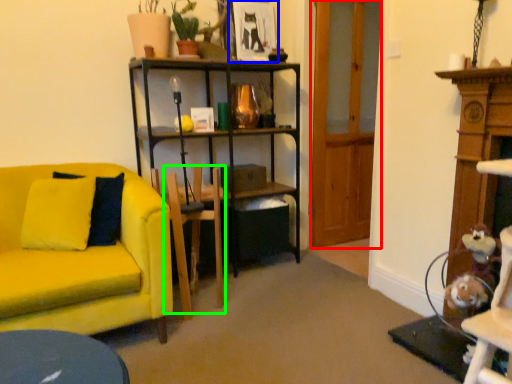
Question: Considering the real-world distances, which object is closest to glass door (highlighted by a red box)? picture frame (highlighted by a blue box) or swivel chair (highlighted by a green box).

Choices:
 (A) picture frame
 (B) swivel chair

Answer: (A)